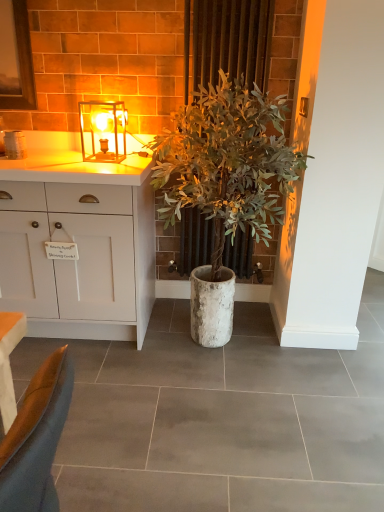
At what (x,y) coordinates should I click in order to perform the action: click on free space in front of matte glass lamp at upper center. Please return your answer as a coordinate pair (x, y). Looking at the image, I should click on (109, 163).